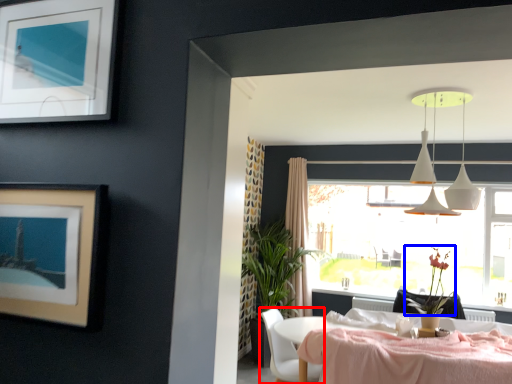
Question: Which object appears farthest to the camera in this image, chair (highlighted by a red box) or flower (highlighted by a blue box)?

Choices:
 (A) chair
 (B) flower

Answer: (B)